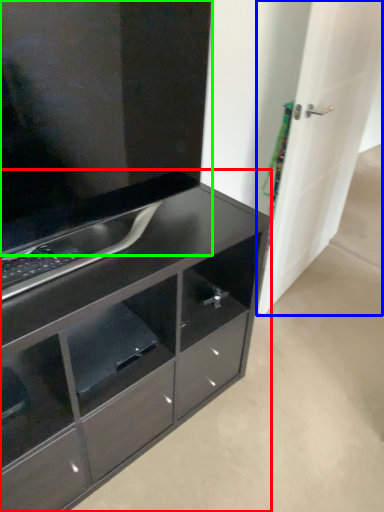
Question: Based on their relative distances, which object is nearer to chest of drawers (highlighted by a red box)? Choose from door (highlighted by a blue box) and cabinetry (highlighted by a green box).

Choices:
 (A) door
 (B) cabinetry

Answer: (B)